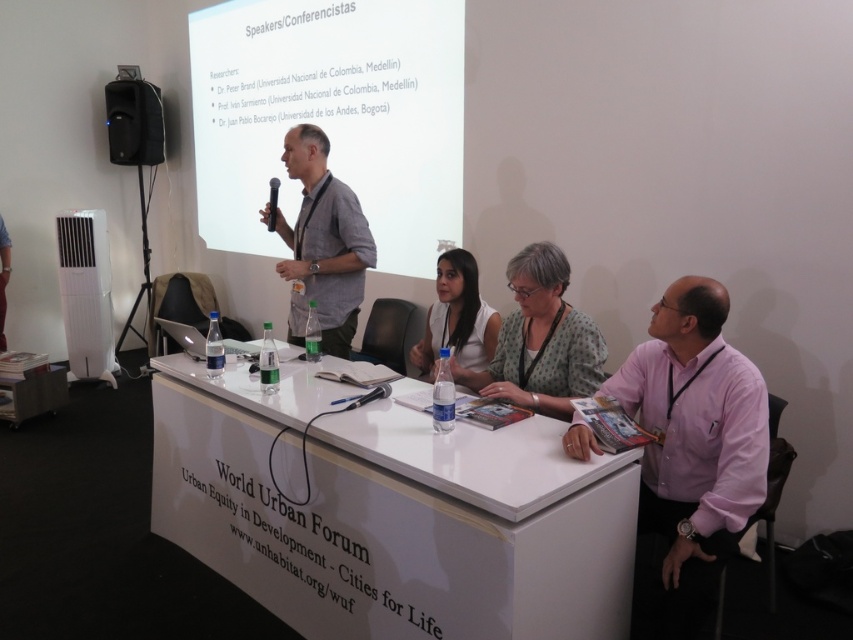
Does white matte projector screen at upper center appear on the left side of gray fabric shirt at center?

Yes, white matte projector screen at upper center is to the left of gray fabric shirt at center.

Does white matte projector screen at upper center have a lesser width compared to gray fabric shirt at center?

No, white matte projector screen at upper center is not thinner than gray fabric shirt at center.

Who is more forward, (x=276, y=8) or (x=341, y=218)?

Positioned in front is point (x=341, y=218).

Where is `white matte projector screen at upper center`? The height and width of the screenshot is (640, 853). white matte projector screen at upper center is located at coordinates (332, 115).

Does white glossy table at center have a smaller size compared to white matte projector screen at upper center?

Yes, white glossy table at center is smaller than white matte projector screen at upper center.

Which is below, white glossy table at center or white matte projector screen at upper center?

Positioned lower is white glossy table at center.

Is point (299, 538) farther from viewer compared to point (405, 253)?

No, it is not.

The image size is (853, 640). What are the coordinates of `white glossy table at center` in the screenshot? It's located at (389, 513).

Can you confirm if white glossy table at center is taller than polka dot blouse at center?

Yes, white glossy table at center is taller than polka dot blouse at center.

Who is more distant from viewer, (305, 625) or (589, 368)?

The point (589, 368) is behind.

Which is behind, point (292, 362) or point (561, 401)?

Positioned behind is point (292, 362).

Image resolution: width=853 pixels, height=640 pixels. Identify the location of white glossy table at center. (389, 513).